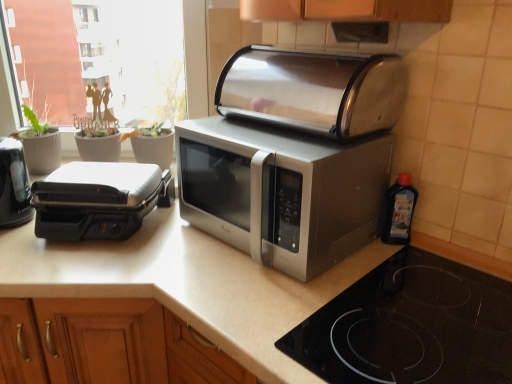
Locate an element on the screen. free region on the left part of transparent plastic bottle at right is located at coordinates (362, 255).